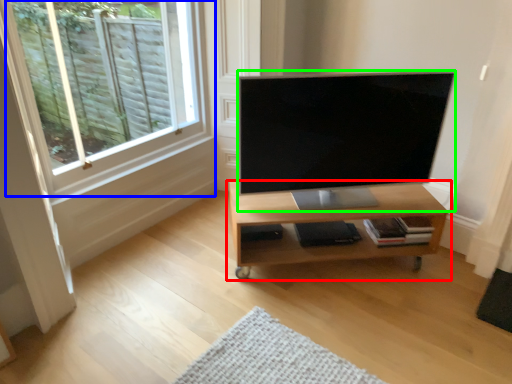
Question: Estimate the real-world distances between objects in this image. Which object is farther from shelf (highlighted by a red box), window (highlighted by a blue box) or television (highlighted by a green box)?

Choices:
 (A) window
 (B) television

Answer: (A)